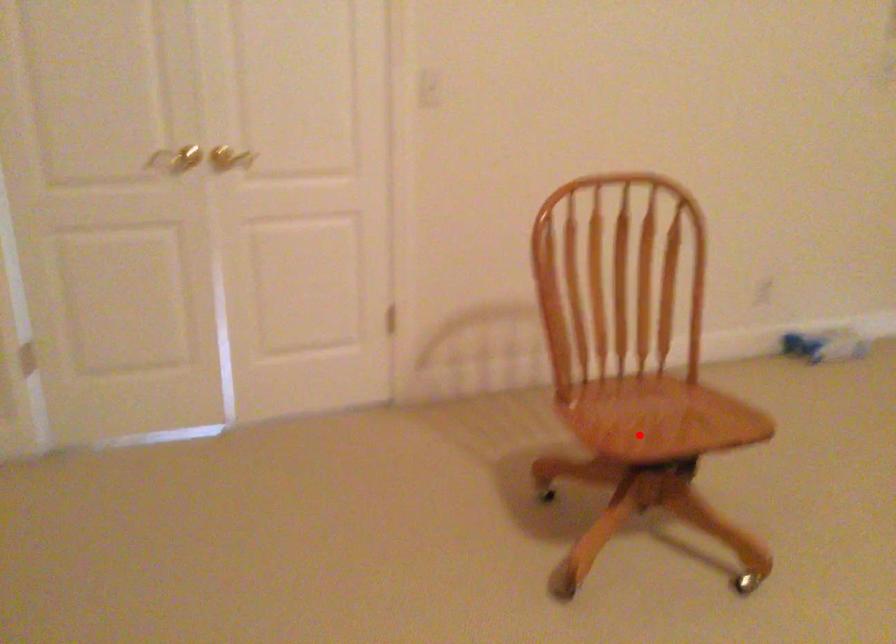
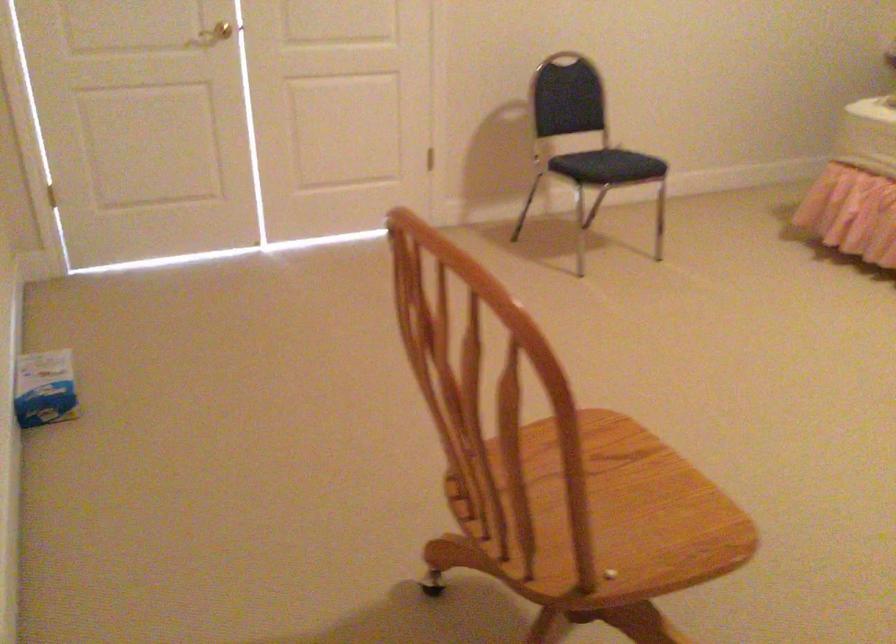
Where in the second image is the point corresponding to the highlighted location from the first image?

(613, 509)